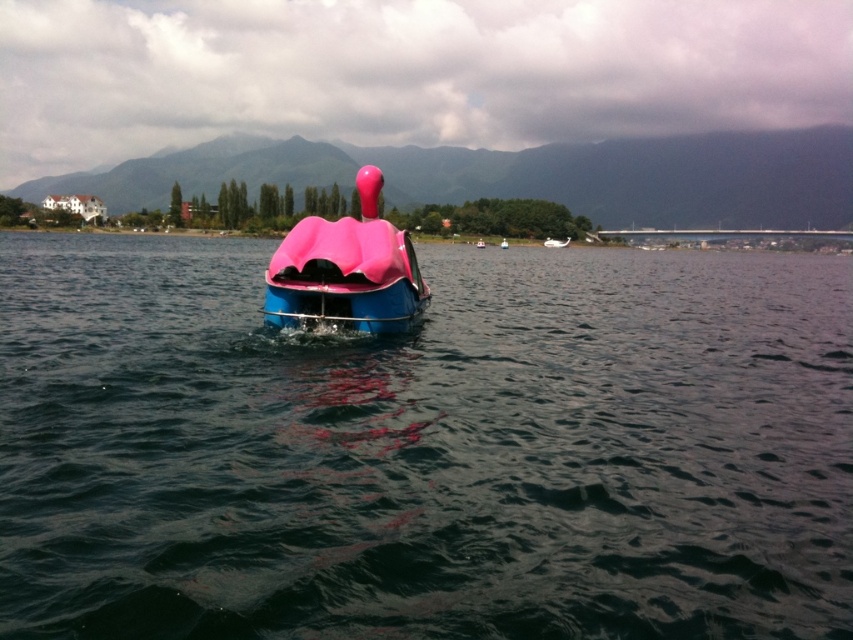
Does transparent blue water at center appear under pink matte swan at center?

Correct, transparent blue water at center is located below pink matte swan at center.

Looking at this image, who is taller, transparent blue water at center or pink matte swan at center?

transparent blue water at center

The width and height of the screenshot is (853, 640). In order to click on transparent blue water at center in this screenshot , I will do `click(424, 449)`.

Is pink matte swan boat at center thinner than pink matte swan at center?

Correct, pink matte swan boat at center's width is less than pink matte swan at center's.

Is pink matte swan boat at center further to the viewer compared to pink matte swan at center?

No, it is not.

Which is behind, point (303, 278) or point (567, 237)?

Positioned behind is point (567, 237).

Find the location of a particular element. The height and width of the screenshot is (640, 853). pink matte swan boat at center is located at coordinates (346, 272).

Can you confirm if transparent blue water at center is smaller than pink matte swan boat at center?

No.

Measure the distance between point (x=792, y=406) and camera.

Point (x=792, y=406) and camera are 8.25 meters apart.

You are a GUI agent. You are given a task and a screenshot of the screen. Output one action in this format:
    pyautogui.click(x=<x>, y=<y>)
    Task: Click on the transparent blue water at center
    Image resolution: width=853 pixels, height=640 pixels.
    Given the screenshot: What is the action you would take?
    pyautogui.click(x=424, y=449)

Locate an element on the screen. transparent blue water at center is located at coordinates (424, 449).